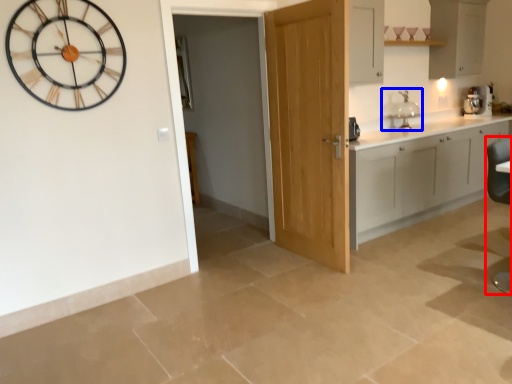
Question: Which point is closer to the camera, swivel chair (highlighted by a red box) or sink (highlighted by a blue box)?

Choices:
 (A) swivel chair
 (B) sink

Answer: (A)